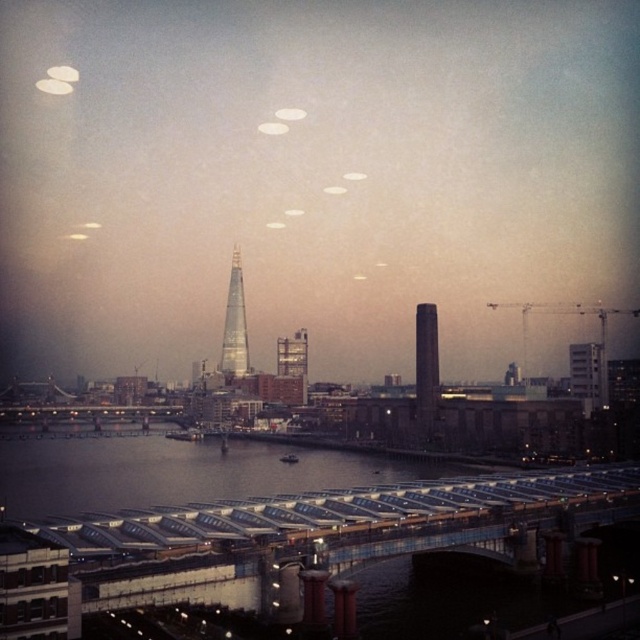
Question: Does shiny glass skyscraper at center have a lesser width compared to white concrete tower at right?

Choices:
 (A) no
 (B) yes

Answer: (A)

Question: Which point appears closest to the camera in this image?

Choices:
 (A) (417, 401)
 (B) (580, 362)

Answer: (B)

Question: In this image, where is shiny glass skyscraper at center located relative to white concrete tower at right?

Choices:
 (A) right
 (B) left

Answer: (B)

Question: Which object is farther from the camera taking this photo?

Choices:
 (A) white concrete tower at right
 (B) smooth glass tower at center
 (C) shiny glass skyscraper at center

Answer: (C)

Question: Is smooth glass tower at center wider than shiny glass skyscraper at center?

Choices:
 (A) no
 (B) yes

Answer: (A)

Question: Which of the following is the farthest from the observer?

Choices:
 (A) (436, 365)
 (B) (243, 312)

Answer: (B)